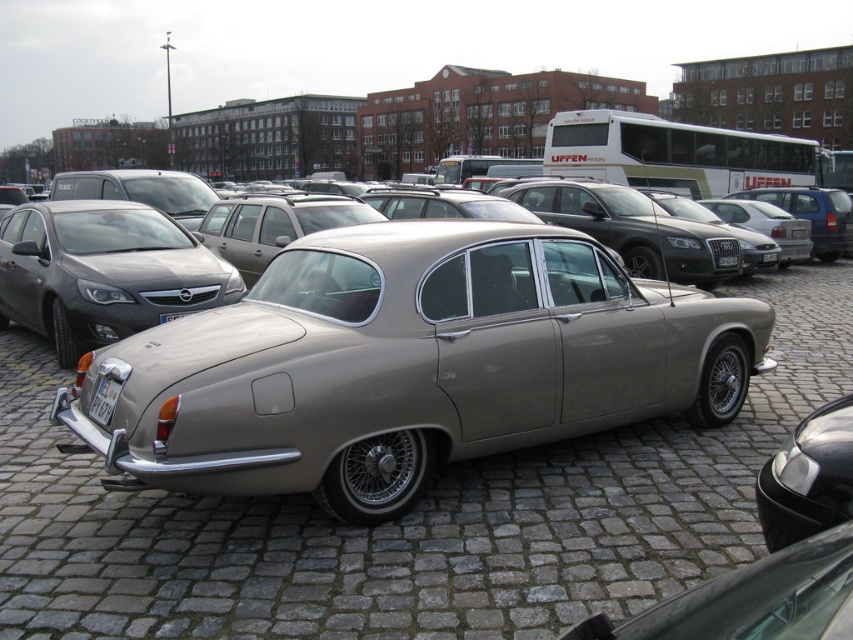
You are a photographer trying to capture the metallic silver car at center and the white plastic license plate at lower left in a single shot. Given that the license plate is smaller, will you need to adjust your camera angle to ensure both are visible clearly?

The metallic silver car at center is larger than the white plastic license plate at lower left, so you can capture both in a single shot without needing to adjust your camera angle excessively. Ensure the license plate is within the frame and focus on the car while maintaining the plate in view.

You are a photographer trying to capture the satin silver car at left and the white plastic license plate at center in the same frame. Since the car is larger, will you need to zoom in or out to ensure both are visible?

The satin silver car at left is larger than the white plastic license plate at center. To include both in the frame, you should zoom out to accommodate the size difference.

You are standing at point (155, 298) and want to walk to the vintage car. The path is clear except for a 6.5 meter long barrier. Can you reach the car without crossing the barrier?

The distance between you and the vintage car is 6.92 meters, and the barrier is 6.5 meters long. Since the barrier is shorter than the distance, you can go around it to reach the car.